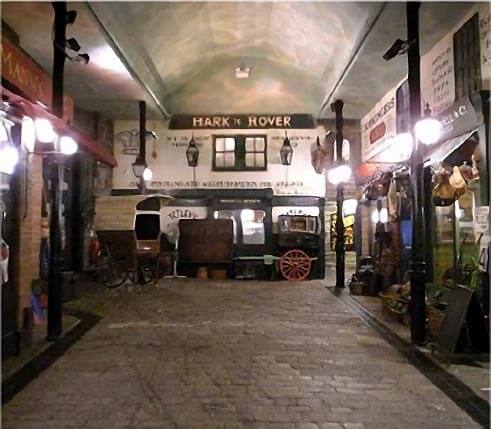
Locate an element on the screen. left lamp not on left of windows is located at coordinates (192, 154).